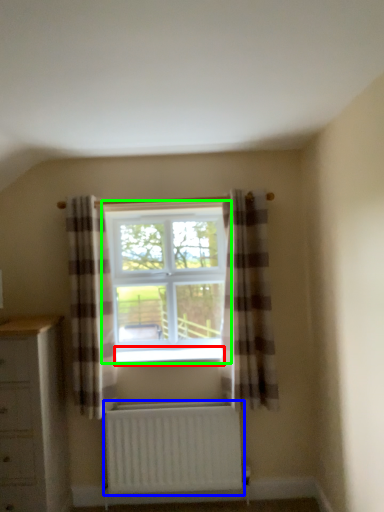
Question: Which object is positioned closest to window sill (highlighted by a red box)? Select from radiator (highlighted by a blue box) and window (highlighted by a green box).

Choices:
 (A) radiator
 (B) window

Answer: (B)